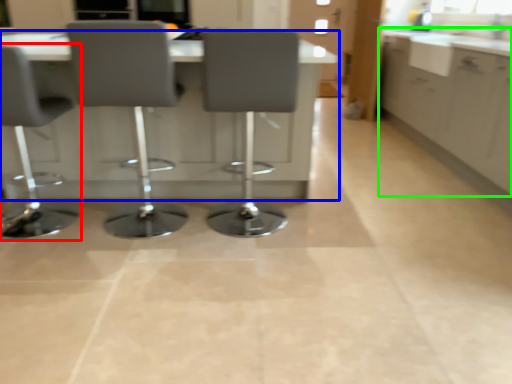
Question: Which object is the farthest from chair (highlighted by a red box)? Choose among these: table (highlighted by a blue box) or cabinetry (highlighted by a green box).

Choices:
 (A) table
 (B) cabinetry

Answer: (B)